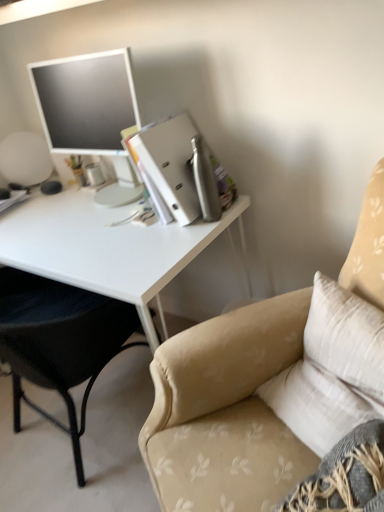
Question: Should I look upward or downward to see beige fabric chair at upper right, which appears as the 1th chair when viewed from the right?

Choices:
 (A) down
 (B) up

Answer: (A)

Question: Is beige fabric chair at left, which is the 2th chair in right-to-left order, thinner than matte silver monitor at upper left?

Choices:
 (A) yes
 (B) no

Answer: (B)

Question: From the image's perspective, does beige fabric chair at left, the first chair positioned from the left, appear lower than matte silver monitor at upper left?

Choices:
 (A) yes
 (B) no

Answer: (A)

Question: Does beige fabric chair at left, which is the 2th chair in right-to-left order, touch matte silver monitor at upper left?

Choices:
 (A) no
 (B) yes

Answer: (A)

Question: From a real-world perspective, is beige fabric chair at left, which is the 2th chair in right-to-left order, located higher than matte silver monitor at upper left?

Choices:
 (A) no
 (B) yes

Answer: (A)

Question: Is beige fabric chair at left, the first chair positioned from the left, at the left side of matte silver monitor at upper left?

Choices:
 (A) no
 (B) yes

Answer: (B)

Question: Would you consider beige fabric chair at left, which is the 2th chair in right-to-left order, to be distant from matte silver monitor at upper left?

Choices:
 (A) no
 (B) yes

Answer: (A)

Question: Is beige fabric chair at upper right, acting as the 2th chair starting from the left, oriented away from white glossy desk at left?

Choices:
 (A) yes
 (B) no

Answer: (B)

Question: From a real-world perspective, is beige fabric chair at upper right, acting as the 2th chair starting from the left, over white glossy desk at left?

Choices:
 (A) no
 (B) yes

Answer: (B)

Question: Is beige fabric chair at upper right, which appears as the 1th chair when viewed from the right, to the right of white glossy desk at left from the viewer's perspective?

Choices:
 (A) yes
 (B) no

Answer: (A)

Question: From a real-world perspective, is beige fabric chair at upper right, acting as the 2th chair starting from the left, physically below white glossy desk at left?

Choices:
 (A) yes
 (B) no

Answer: (B)

Question: Is beige fabric chair at upper right, acting as the 2th chair starting from the left, taller than white glossy desk at left?

Choices:
 (A) yes
 (B) no

Answer: (A)

Question: Is white glossy desk at left surrounded by beige fabric chair at upper right, acting as the 2th chair starting from the left?

Choices:
 (A) no
 (B) yes

Answer: (A)

Question: Can you confirm if metallic silver binder at upper right is taller than beige fabric chair at left, the first chair positioned from the left?

Choices:
 (A) no
 (B) yes

Answer: (A)